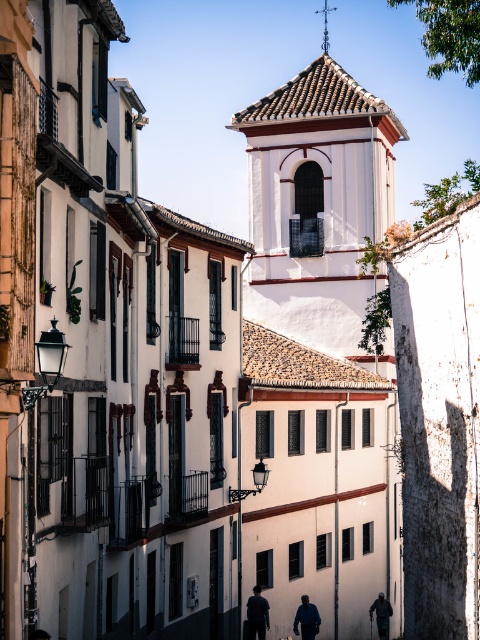
Question: Which point is farther to the camera?

Choices:
 (A) (259, 621)
 (B) (297, 627)
 (C) (377, 600)

Answer: (C)

Question: Is white textured tower at center further to the viewer compared to dark gray fabric jacket at lower right?

Choices:
 (A) no
 (B) yes

Answer: (A)

Question: Is dark blue jacket at center further to the viewer compared to dark gray fabric jacket at lower right?

Choices:
 (A) no
 (B) yes

Answer: (A)

Question: Which point is closer to the camera?

Choices:
 (A) (317, 612)
 (B) (380, 614)
 (C) (368, 157)

Answer: (A)

Question: Does white textured tower at center appear under dark gray fabric jacket at lower right?

Choices:
 (A) yes
 (B) no

Answer: (B)

Question: Among these points, which one is farthest from the camera?

Choices:
 (A) (310, 305)
 (B) (302, 632)
 (C) (373, 605)

Answer: (A)